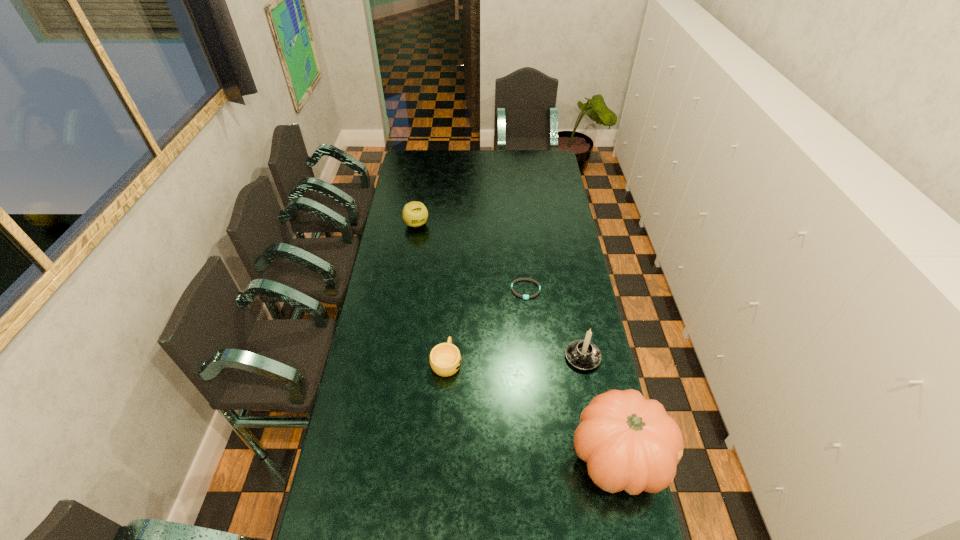
At what (x,y) coordinates should I click in order to perform the action: click on object located at the left edge. Please return your answer as a coordinate pair (x, y). Looking at the image, I should click on (415, 214).

The image size is (960, 540). Identify the location of pumpkin that is at the right edge. (630, 443).

The image size is (960, 540). Identify the location of candle holder that is at the right edge. (582, 354).

Where is `object that is positioned at the near right corner`? This screenshot has height=540, width=960. object that is positioned at the near right corner is located at coordinates (630, 443).

Locate an element on the screen. vacant space at the near edge of the desktop is located at coordinates (541, 525).

Where is `vacant space at the left edge of the desktop`? vacant space at the left edge of the desktop is located at coordinates (386, 323).

Where is `free region at the right edge`? The width and height of the screenshot is (960, 540). free region at the right edge is located at coordinates (563, 226).

Locate an element on the screen. free location at the far left corner is located at coordinates (425, 159).

The height and width of the screenshot is (540, 960). Find the location of `vacant region between the nearest object and the second shortest object`. vacant region between the nearest object and the second shortest object is located at coordinates (532, 409).

Locate an element on the screen. The image size is (960, 540). vacant space in between the softball and the fourth object from right to left is located at coordinates (431, 293).